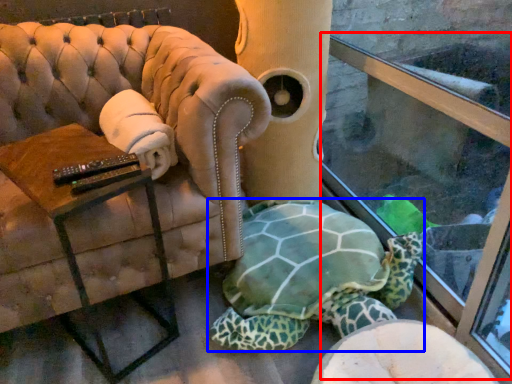
Question: Among these objects, which one is farthest to the camera, shop window (highlighted by a red box) or tortoise (highlighted by a blue box)?

Choices:
 (A) shop window
 (B) tortoise

Answer: (B)